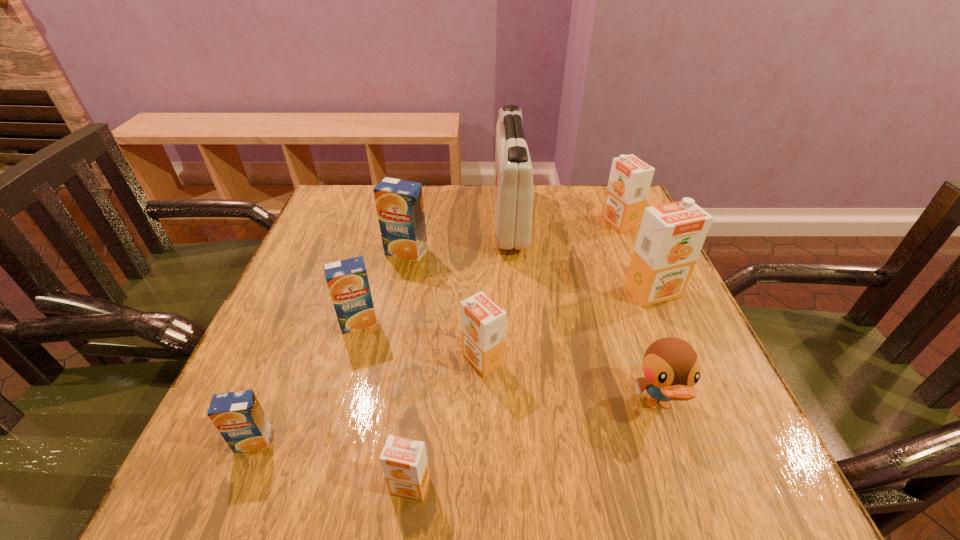
Where is `orange orange juice that is the third closest to the nearest orange orange juice`? The image size is (960, 540). orange orange juice that is the third closest to the nearest orange orange juice is located at coordinates (630, 178).

Choose which orange orange juice is the second nearest neighbor to the biggest orange orange juice. Please provide its 2D coordinates. Your answer should be formatted as a tuple, i.e. [(x, y)], where the tuple contains the x and y coordinates of a point satisfying the conditions above.

[(483, 323)]

Identify which blue orange_juice is the third closest to the duck. Please provide its 2D coordinates. Your answer should be formatted as a tuple, i.e. [(x, y)], where the tuple contains the x and y coordinates of a point satisfying the conditions above.

[(238, 416)]

Locate an element on the screen. the second closest blue orange_juice to the leftmost blue orange_juice is located at coordinates (399, 203).

The image size is (960, 540). In order to click on vacant space that satisfies the following two spatial constraints: 1. on the front side of the fourth nearest orange juice; 2. on the left side of the fifth farthest orange juice in this screenshot , I will do `click(348, 359)`.

The width and height of the screenshot is (960, 540). What are the coordinates of `free spot that satisfies the following two spatial constraints: 1. on the back side of the second farthest orange juice; 2. on the right side of the nearest blue orange_juice` in the screenshot? It's located at (332, 252).

Find the location of a particular element. The width and height of the screenshot is (960, 540). vacant area that satisfies the following two spatial constraints: 1. on the back side of the second nearest blue orange_juice; 2. on the right side of the second nearest orange juice is located at coordinates (303, 322).

Identify the location of vacant position in the image that satisfies the following two spatial constraints: 1. on the back side of the biggest orange orange juice; 2. on the left side of the third orange juice from right to left. The image size is (960, 540). (482, 292).